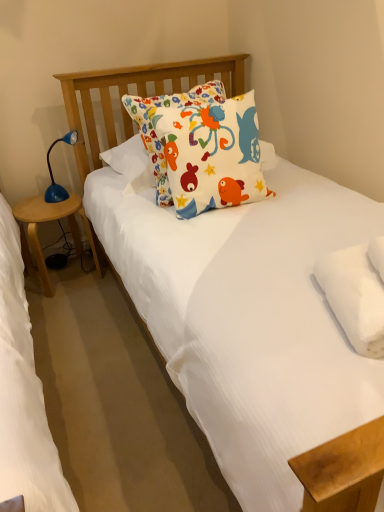
The width and height of the screenshot is (384, 512). In order to click on blank space situated above wooden side table at left (from a real-world perspective) in this screenshot , I will do `click(46, 204)`.